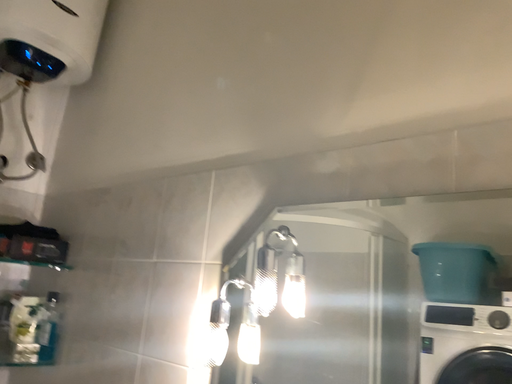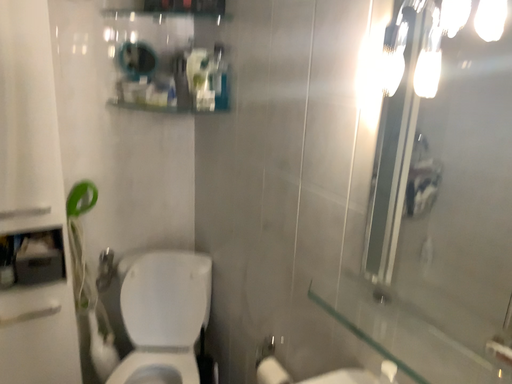
Question: Which way did the camera rotate in the video?

Choices:
 (A) rotated downward
 (B) rotated upward

Answer: (A)